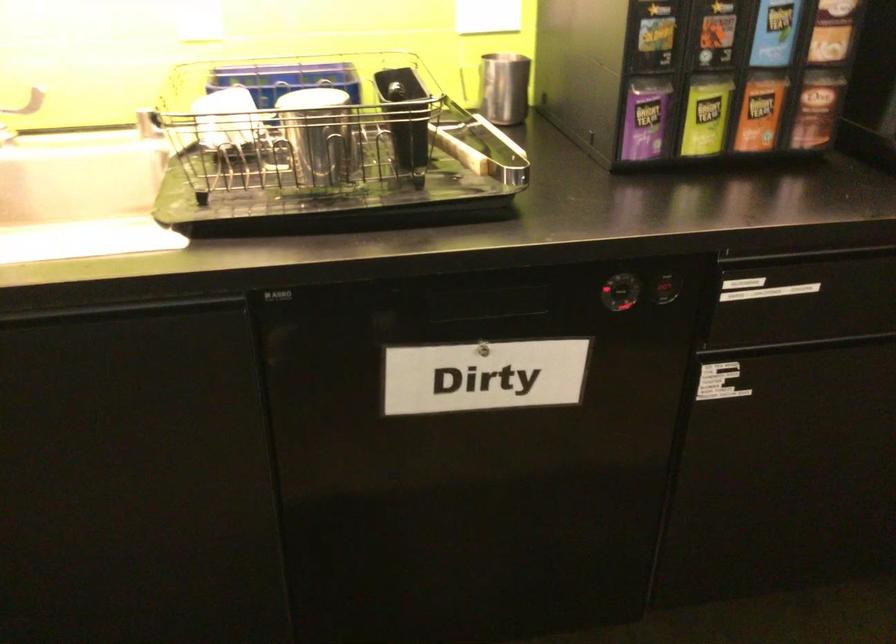
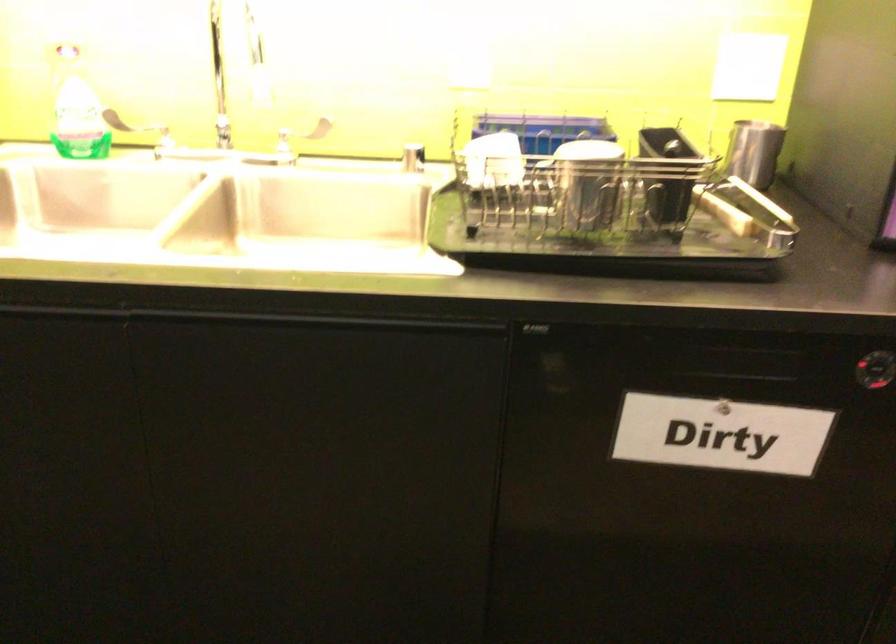
Question: The camera is either moving clockwise (left) or counter-clockwise (right) around the object. The first image is from the beginning of the video and the second image is from the end. Is the camera moving left or right when shooting the video?

Choices:
 (A) Left
 (B) Right

Answer: (B)